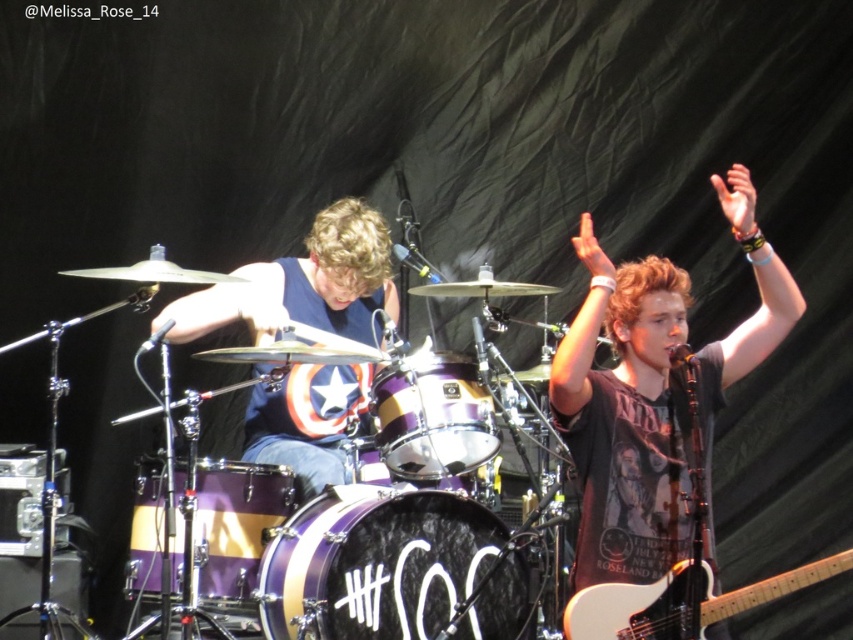
You are setting up a music stand between the black textured drum at center and the shiny purple drum at center. Which drum should you place the stand closer to to ensure it doesn

The black textured drum at center has a larger width than the shiny purple drum at center, so placing the stand closer to the shiny purple drum at center would provide more space between the stand and the larger drum.

You are a photographer positioned at the back of the concert venue. You want to capture a photo that includes both the shiny purple drum set at center and the purple metallic drum at center. Based on their positions, which object should you place on the left side of your camera frame to ensure both are in the shot?

To include both the shiny purple drum set at center and the purple metallic drum at center in your photo, you should place the purple metallic drum at center on the left side of your camera frame. This is because the shiny purple drum set at center is positioned to the right of the purple metallic drum at center, so arranging them with the metallic drum on the left will naturally include both in the frame.